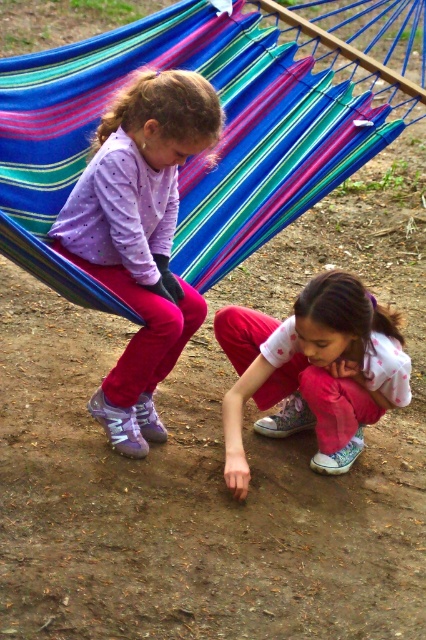
You are a photographer trying to capture a clear shot of the pink cotton pants at lower center without the multicolored striped hammock at upper center blocking the view. Based on their positions, is this possible?

The multicolored striped hammock at upper center is positioned over the pink cotton pants at lower center, so the hammock is blocking the view of the pants. To capture a clear shot of the pink cotton pants at lower center without obstruction, you would need to adjust your angle or move the hammock.

You are a fashion designer observing the two children in the image. You need to determine which clothing item is narrower between the purple matte shirt at upper left and the pink cotton pants at lower center. Which one is narrower?

The purple matte shirt at upper left is narrower than the pink cotton pants at lower center because its width is less than that of the pink cotton pants at lower center.

You are a photographer trying to capture a photo of the purple matte shirt at upper left without the multicolored striped hammock at upper center blocking it. Is this possible based on their positions?

The multicolored striped hammock at upper center is positioned over the purple matte shirt at upper left, so it would block the view of the purple matte shirt at upper left. You cannot capture a clear photo of the purple matte shirt at upper left without the hammock obstructing it.